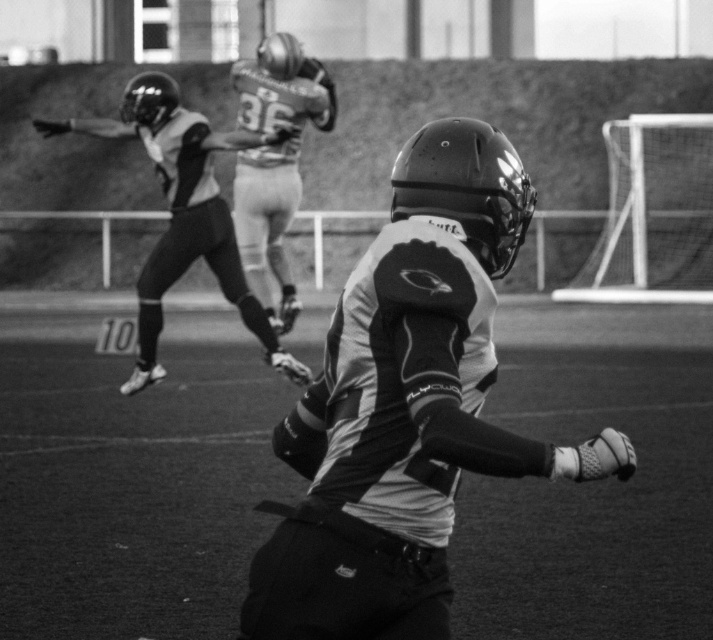
Question: Does matte black jersey at upper left have a smaller size compared to metallic silver helmet at upper center?

Choices:
 (A) yes
 (B) no

Answer: (B)

Question: Which of the following is the closest to the observer?

Choices:
 (A) (282, 182)
 (B) (148, 285)
 (C) (507, 474)

Answer: (C)

Question: Based on their relative distances, which object is nearer to the metallic silver helmet at upper center?

Choices:
 (A) matte black helmet at center
 (B) matte black jersey at upper left

Answer: (B)

Question: Is matte black helmet at center closer to the viewer compared to matte black jersey at upper left?

Choices:
 (A) yes
 (B) no

Answer: (A)

Question: Is matte black helmet at center wider than matte black jersey at upper left?

Choices:
 (A) yes
 (B) no

Answer: (B)

Question: Which object is positioned closest to the metallic silver helmet at upper center?

Choices:
 (A) matte black helmet at center
 (B) matte black jersey at upper left

Answer: (B)